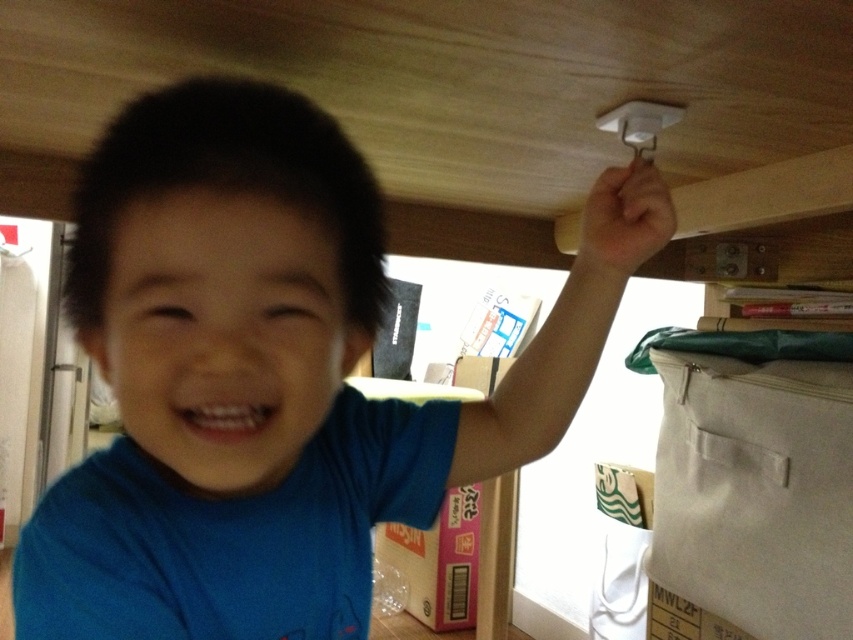
Does blue t-shirt at center appear over canvas bag at right?

Yes.

Between blue t-shirt at center and canvas bag at right, which one has more height?

With more height is canvas bag at right.

Is point (485, 413) less distant than point (788, 369)?

Yes, point (485, 413) is in front of point (788, 369).

Where is `blue t-shirt at center`? The image size is (853, 640). blue t-shirt at center is located at coordinates (271, 376).